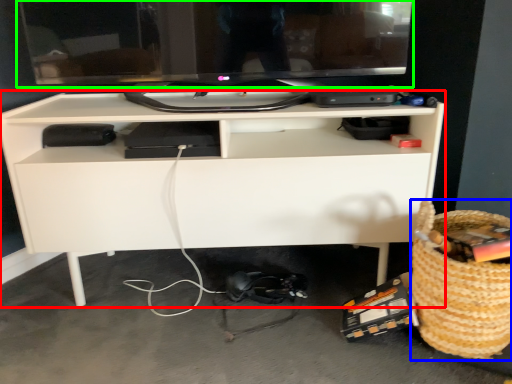
Question: Which object is positioned closest to desk (highlighted by a red box)? Select from basket (highlighted by a blue box) and computer monitor (highlighted by a green box).

Choices:
 (A) basket
 (B) computer monitor

Answer: (B)